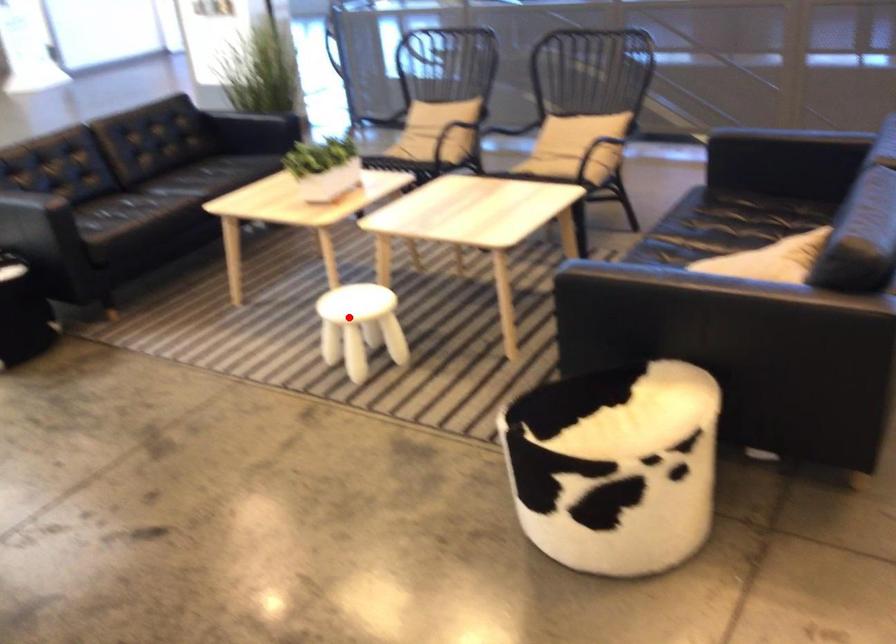
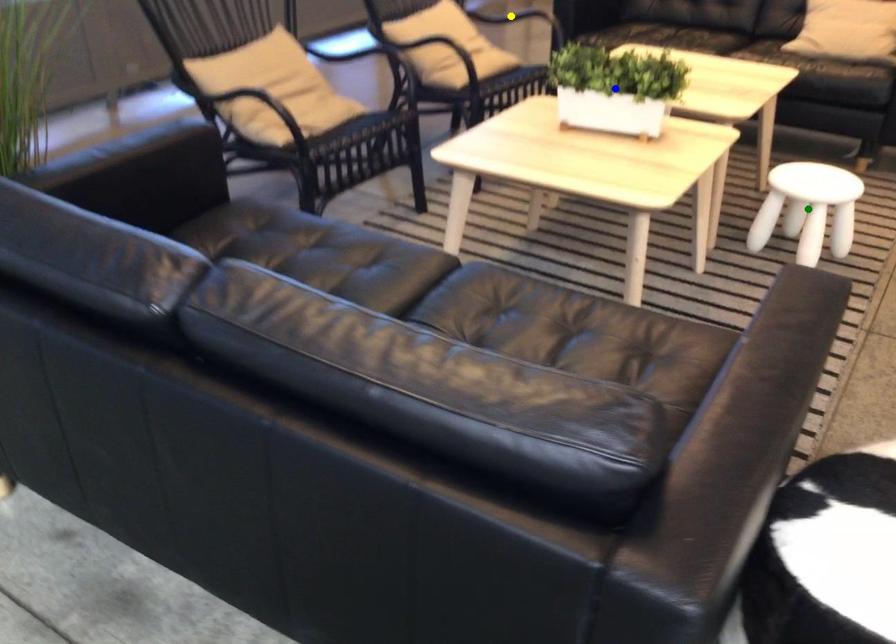
Question: I am providing you with two images of the same scene from different viewpoints. A red point is marked on the first image. You are given multiple points on the second image. Which point in image 2 is actually the same real-world point as the red point in image 1?

Choices:
 (A) green point
 (B) yellow point
 (C) blue point

Answer: (A)